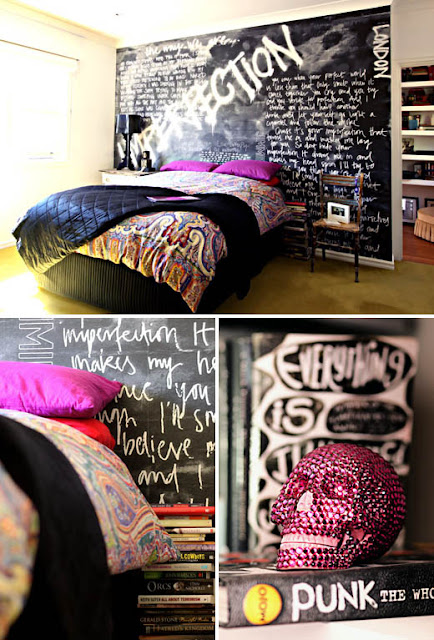
Locate an element on the screen. The width and height of the screenshot is (434, 640). light brown wood flooring is located at coordinates (328, 299).